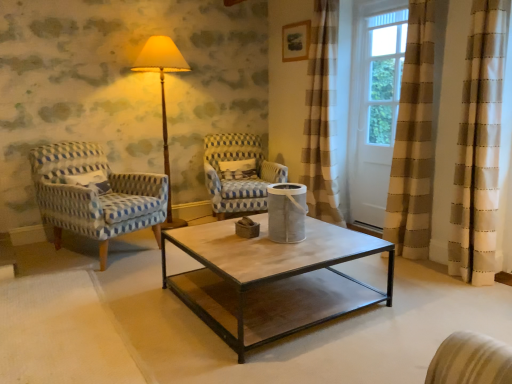
Question: Can you confirm if blue-patterned fabric armchair at left, which is the 2th chair from right to left, is smaller than blue and white woven fabric armchair at center, which is the second chair in left-to-right order?

Choices:
 (A) yes
 (B) no

Answer: (B)

Question: From a real-world perspective, is blue-patterned fabric armchair at left, which is the 2th chair from right to left, physically below blue and white woven fabric armchair at center, which is the second chair in left-to-right order?

Choices:
 (A) no
 (B) yes

Answer: (B)

Question: Would you say blue-patterned fabric armchair at left, which is the 2th chair from right to left, is outside blue and white woven fabric armchair at center, which appears as the 1th chair when viewed from the right?

Choices:
 (A) yes
 (B) no

Answer: (A)

Question: Can you confirm if blue-patterned fabric armchair at left, which is the 1th chair from left to right, is wider than blue and white woven fabric armchair at center, which appears as the 1th chair when viewed from the right?

Choices:
 (A) yes
 (B) no

Answer: (A)

Question: Can you confirm if blue-patterned fabric armchair at left, which is the 1th chair from left to right, is shorter than blue and white woven fabric armchair at center, which is the second chair in left-to-right order?

Choices:
 (A) yes
 (B) no

Answer: (B)

Question: Is blue-patterned fabric armchair at left, which is the 2th chair from right to left, touching blue and white woven fabric armchair at center, which is the second chair in left-to-right order?

Choices:
 (A) yes
 (B) no

Answer: (B)

Question: From the image's perspective, is white wood screen door at upper right beneath white textured pillow at center?

Choices:
 (A) no
 (B) yes

Answer: (A)

Question: Considering the relative sizes of white wood screen door at upper right and white textured pillow at center in the image provided, is white wood screen door at upper right taller than white textured pillow at center?

Choices:
 (A) no
 (B) yes

Answer: (B)

Question: Is white wood screen door at upper right at the left side of white textured pillow at center?

Choices:
 (A) yes
 (B) no

Answer: (B)

Question: Does white wood screen door at upper right turn towards white textured pillow at center?

Choices:
 (A) no
 (B) yes

Answer: (A)

Question: Is white wood screen door at upper right positioned before white textured pillow at center?

Choices:
 (A) no
 (B) yes

Answer: (B)

Question: Is white wood screen door at upper right smaller than white textured pillow at center?

Choices:
 (A) no
 (B) yes

Answer: (A)

Question: Is white textured pillow at center surrounding white wood screen door at upper right?

Choices:
 (A) no
 (B) yes

Answer: (A)